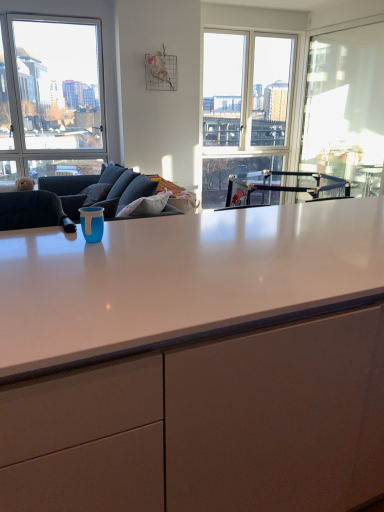
Question: Is clear glass window at upper left not inside white glossy cabinet at center?

Choices:
 (A) no
 (B) yes

Answer: (B)

Question: Can you confirm if clear glass window at upper left is bigger than white glossy cabinet at center?

Choices:
 (A) yes
 (B) no

Answer: (B)

Question: From the image's perspective, would you say clear glass window at upper left is positioned over white glossy cabinet at center?

Choices:
 (A) yes
 (B) no

Answer: (A)

Question: Is clear glass window at upper left oriented towards white glossy cabinet at center?

Choices:
 (A) no
 (B) yes

Answer: (B)

Question: Is white glossy cabinet at center located within clear glass window at upper left?

Choices:
 (A) yes
 (B) no

Answer: (B)

Question: Is white glossy cabinet at center at the back of clear glass window at upper left?

Choices:
 (A) yes
 (B) no

Answer: (B)

Question: Does white glossy cabinet at center contain clear glass window at upper left?

Choices:
 (A) yes
 (B) no

Answer: (B)

Question: Is white glossy cabinet at center positioned behind clear glass window at upper left?

Choices:
 (A) no
 (B) yes

Answer: (A)

Question: Does white glossy cabinet at center appear on the right side of clear glass window at upper left?

Choices:
 (A) yes
 (B) no

Answer: (A)

Question: From a real-world perspective, is white glossy cabinet at center located higher than clear glass window at upper left?

Choices:
 (A) no
 (B) yes

Answer: (A)

Question: Does white glossy cabinet at center have a lesser height compared to clear glass window at upper left?

Choices:
 (A) no
 (B) yes

Answer: (B)

Question: Is white glossy cabinet at center outside of clear glass window at upper left?

Choices:
 (A) no
 (B) yes

Answer: (B)

Question: Is clear glass window at upper left oriented towards transparent glass window screen at right?

Choices:
 (A) no
 (B) yes

Answer: (A)